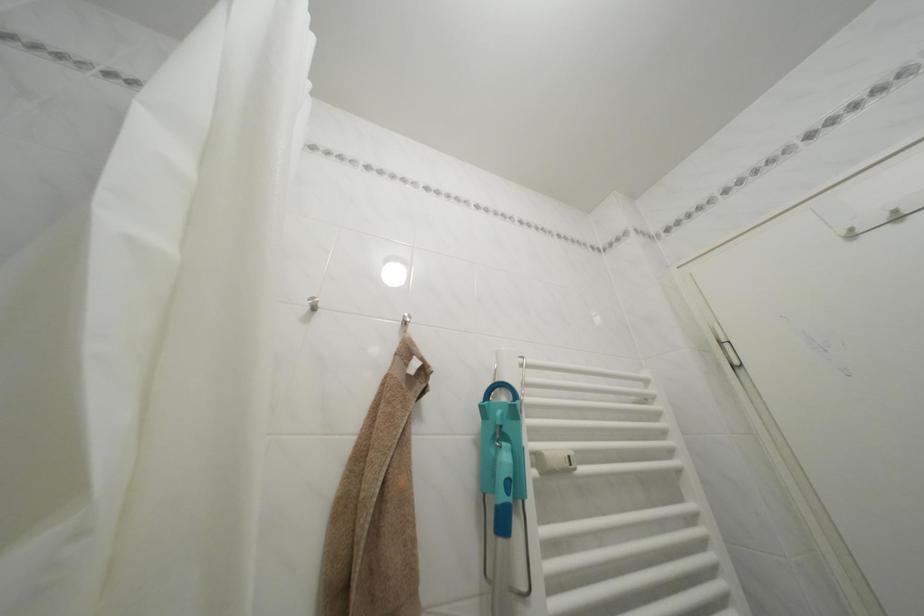
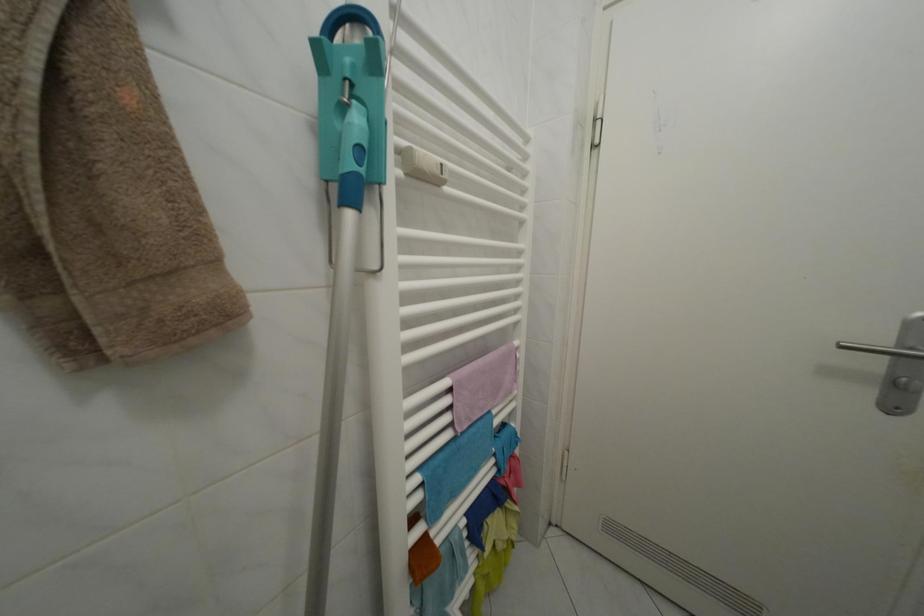
Find the pixel in the second image that matches point 518,506 in the first image.

(371, 177)